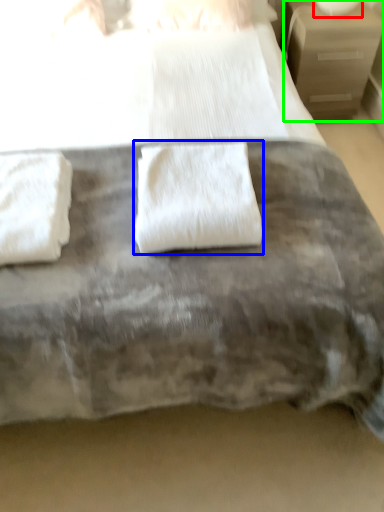
Question: Estimate the real-world distances between objects in this image. Which object is farther from table lamp (highlighted by a red box), towel (highlighted by a blue box) or nightstand (highlighted by a green box)?

Choices:
 (A) towel
 (B) nightstand

Answer: (A)